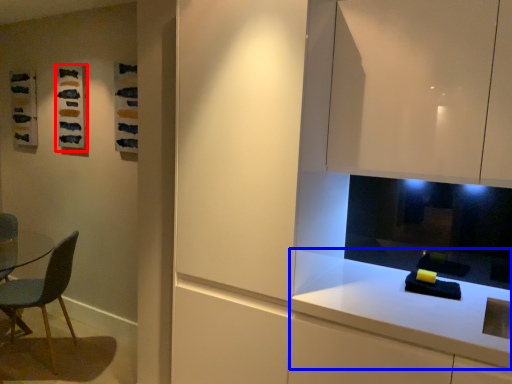
Question: Which object appears farthest to the camera in this image, art (highlighted by a red box) or countertop (highlighted by a blue box)?

Choices:
 (A) art
 (B) countertop

Answer: (A)